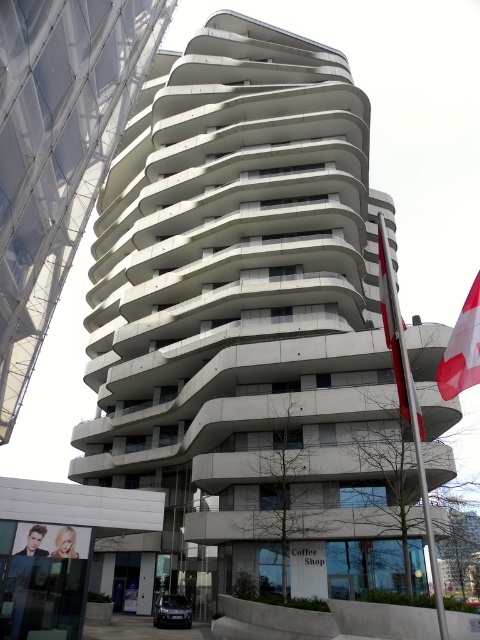
You are standing in front of the modern building and notice two flags. The red fabric flag at right and the red and white striped flag at upper right. Which flag is closer to you?

The red fabric flag at right is closer to you because it is further to the viewer than the red and white striped flag at upper right.

You are standing in front of the modern building and notice two flags. The red fabric flag at right and the red and white striped flag at upper right. Which flag is taller?

The red fabric flag at right is taller than the red and white striped flag at upper right.

You are a delivery person standing at the entrance of the building. You need to place a package under the flag that is closer to the Coffee Shop sign. Which flag should you choose between the red fabric flag at right and the red and white striped flag at upper right?

The red fabric flag at right is closer to the Coffee Shop sign because the distance between the red fabric flag at right and the red and white striped flag at upper right is 20.47 meters, so the red fabric flag at right is the closer one to the Coffee Shop sign.